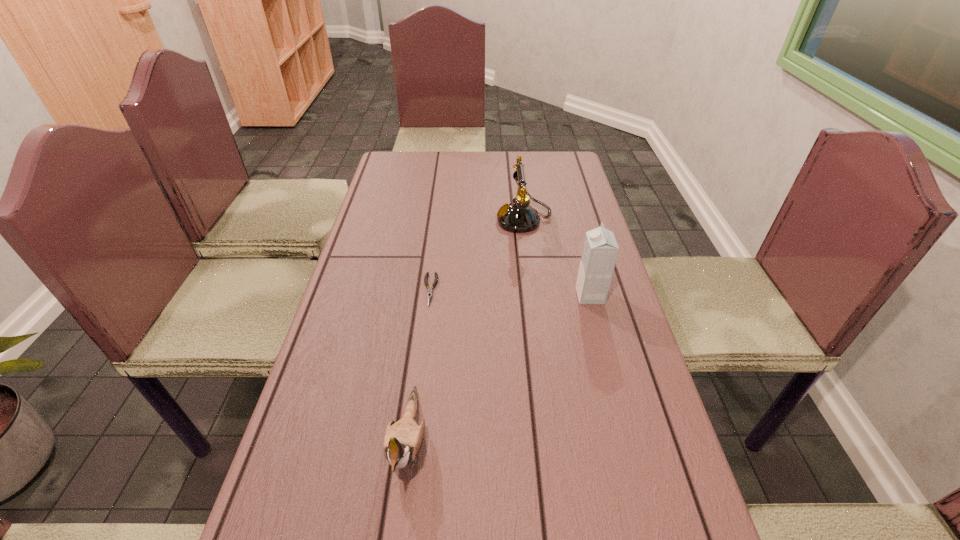
Identify which object is the third nearest to the pliers. Please provide its 2D coordinates. Your answer should be formatted as a tuple, i.e. [(x, y)], where the tuple contains the x and y coordinates of a point satisfying the conditions above.

[(600, 250)]

Locate which object is the third closest to the bird. Please provide its 2D coordinates. Your answer should be formatted as a tuple, i.e. [(x, y)], where the tuple contains the x and y coordinates of a point satisfying the conditions above.

[(519, 217)]

Identify the location of vacant space that satisfies the following two spatial constraints: 1. on the front label of the tallest object; 2. at the face of the nearest object. This screenshot has height=540, width=960. (628, 441).

What are the coordinates of `free spot that satisfies the following two spatial constraints: 1. on the dial of the telephone; 2. at the face of the bird` in the screenshot? It's located at (553, 441).